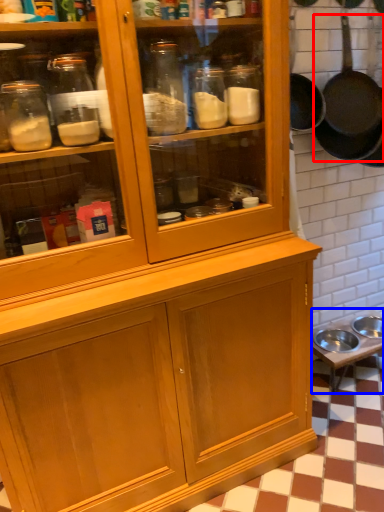
Question: Which object is further to the camera taking this photo, frying pan (highlighted by a red box) or table (highlighted by a blue box)?

Choices:
 (A) frying pan
 (B) table

Answer: (B)